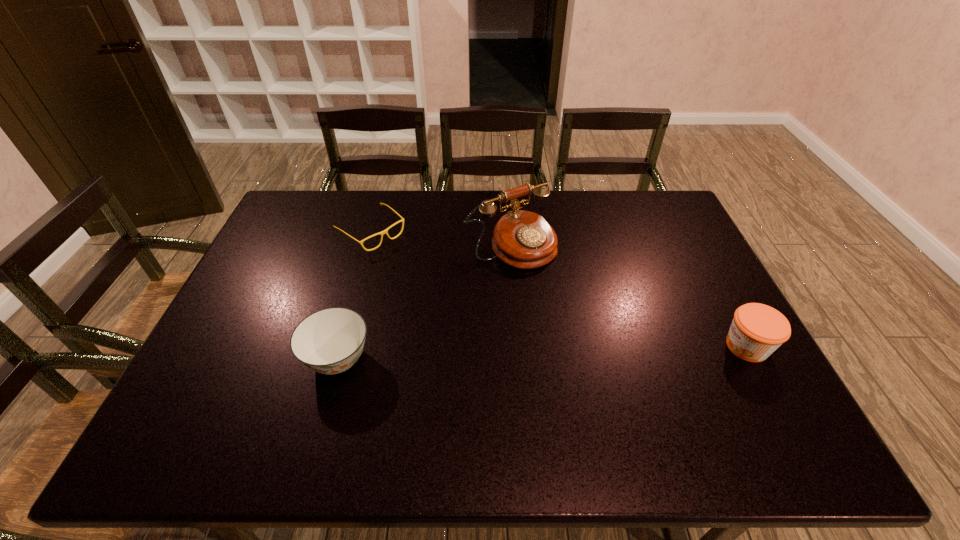
At what (x,y) coordinates should I click in order to perform the action: click on free space between the soup bowl and the shortest object. Please return your answer as a coordinate pair (x, y). This screenshot has height=540, width=960. Looking at the image, I should click on (354, 295).

This screenshot has width=960, height=540. Identify the location of vacant area that lies between the shortest object and the tallest object. (441, 239).

Where is `vacant region between the rightmost object and the shortest object`? The image size is (960, 540). vacant region between the rightmost object and the shortest object is located at coordinates (559, 289).

Image resolution: width=960 pixels, height=540 pixels. Find the location of `unoccupied area between the third object from left to right and the spectacles`. unoccupied area between the third object from left to right and the spectacles is located at coordinates click(x=441, y=239).

Locate an element on the screen. free spot between the telephone and the shortest object is located at coordinates (441, 239).

Identify the location of blank region between the rightmost object and the soup bowl. (542, 353).

I want to click on object identified as the third closest to the second object from right to left, so click(757, 330).

Locate an element on the screen. object identified as the second closest to the rightmost object is located at coordinates (330, 341).

Where is `free location that satisfies the following two spatial constraints: 1. on the front side of the soup bowl; 2. on the left side of the shortest object`? This screenshot has width=960, height=540. free location that satisfies the following two spatial constraints: 1. on the front side of the soup bowl; 2. on the left side of the shortest object is located at coordinates (335, 359).

This screenshot has height=540, width=960. Find the location of `vacant position in the image that satisfies the following two spatial constraints: 1. on the back side of the rightmost object; 2. on the front label of the soup bowl`. vacant position in the image that satisfies the following two spatial constraints: 1. on the back side of the rightmost object; 2. on the front label of the soup bowl is located at coordinates (341, 346).